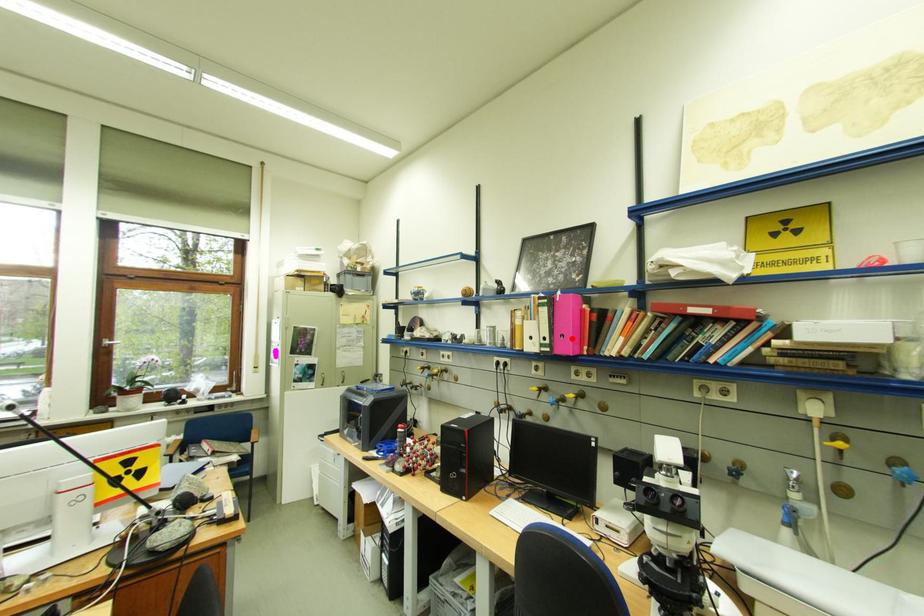
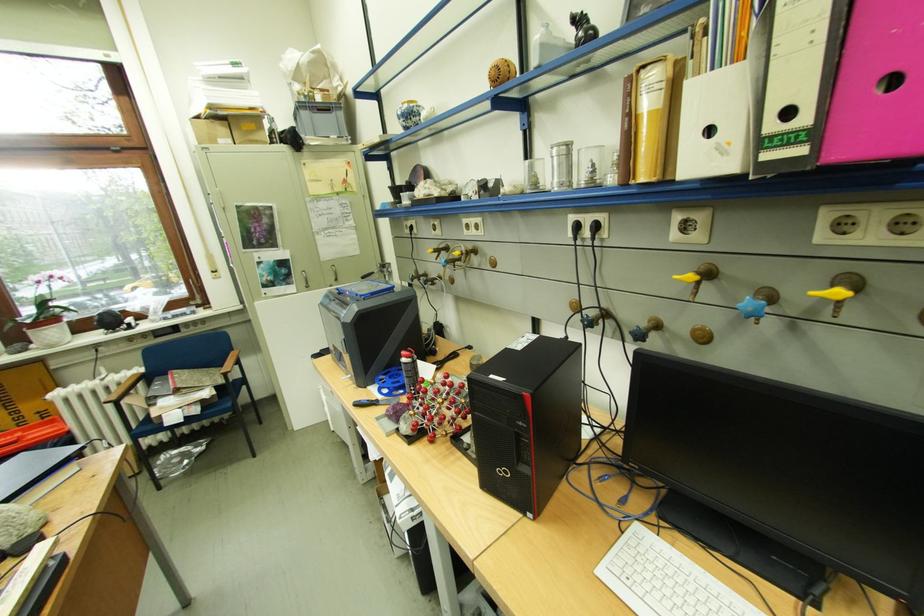
The point at the highlighted location is marked in the first image. Where is the corresponding point in the second image?

(890, 92)